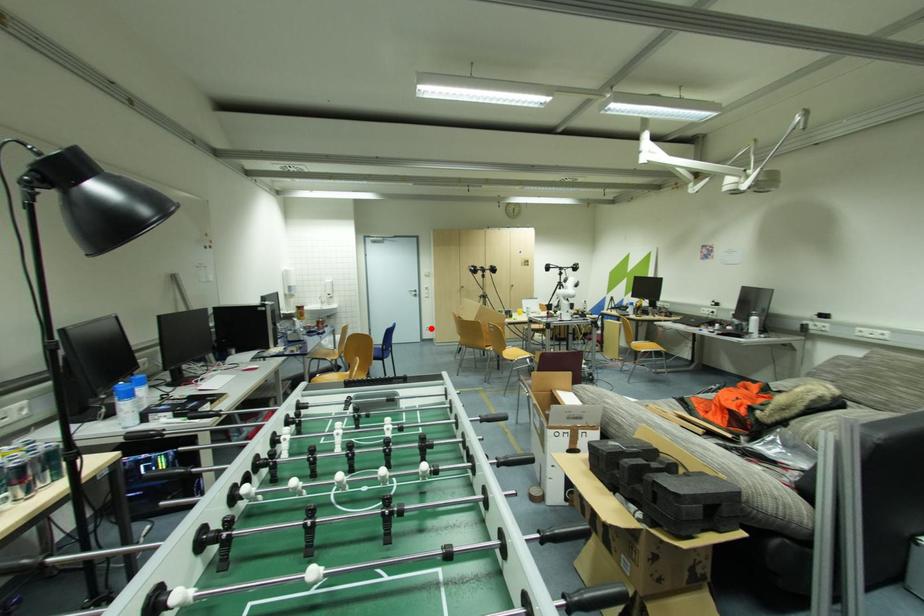
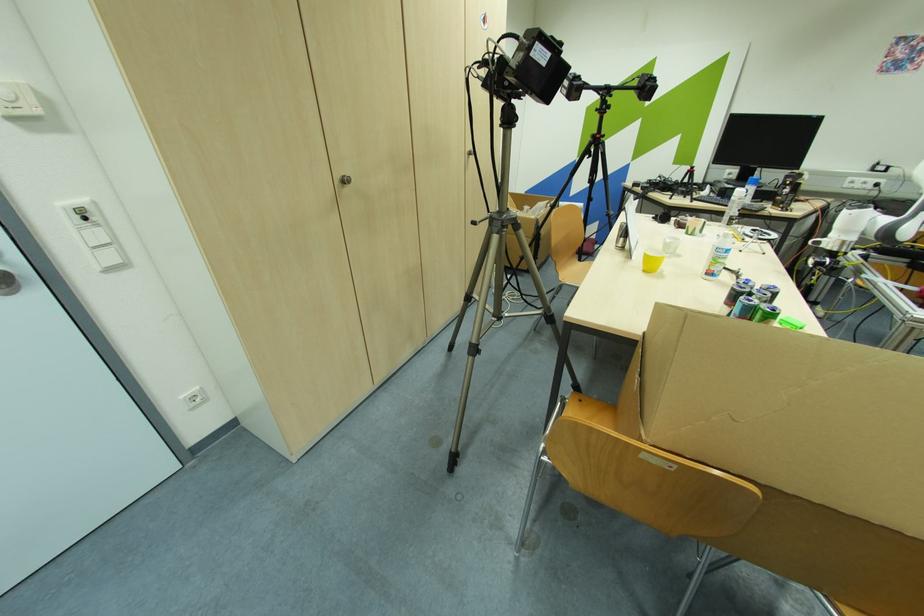
Question: I am providing you with two images of the same scene from different viewpoints. Given a red point in image1, look at the same physical point in image2. Is it:

Choices:
 (A) Closer to the viewpoint
 (B) Farther from the viewpoint

Answer: (A)